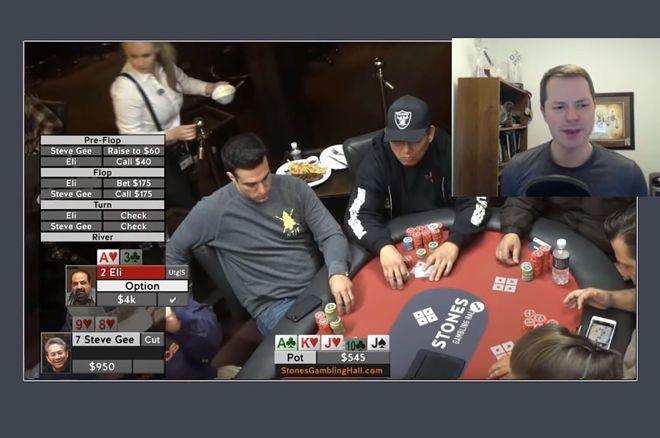
Locate an element on the screen. This screenshot has height=438, width=660. book shelf is located at coordinates (480, 94).